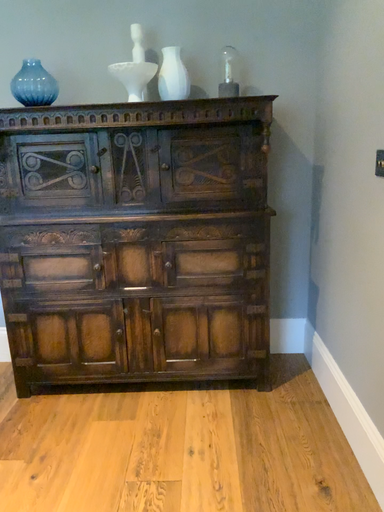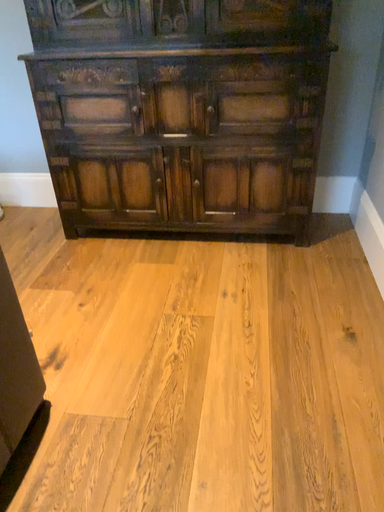
Question: Which way did the camera rotate in the video?

Choices:
 (A) rotated left
 (B) rotated right

Answer: (A)